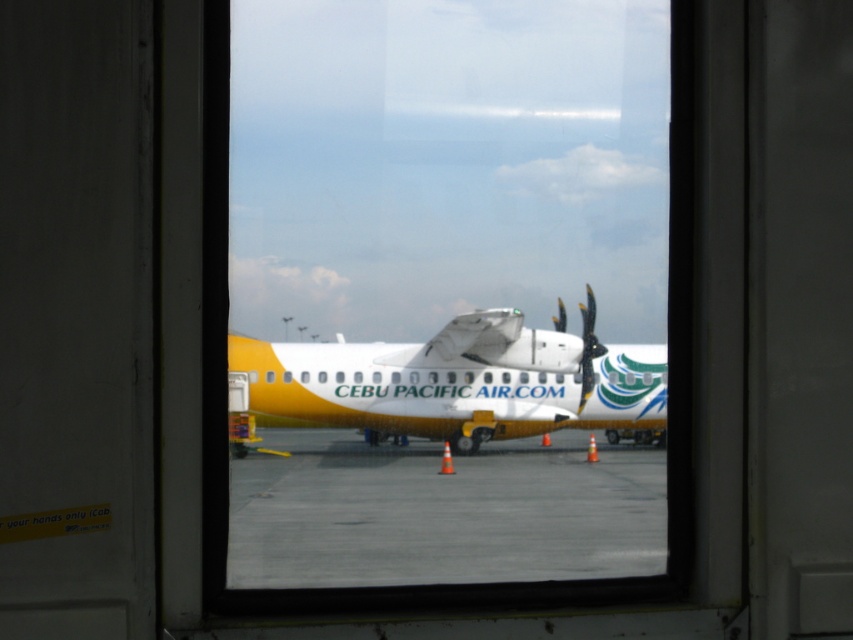
Does transparent glass airplane at center appear on the right side of yellow matte airplane at center?

Indeed, transparent glass airplane at center is positioned on the right side of yellow matte airplane at center.

Is point (323, 560) closer to camera compared to point (312, 403)?

Yes, point (323, 560) is closer to viewer.

Identify the location of transparent glass airplane at center. (445, 292).

Based on the photo, is the position of concrete tarmac at center less distant than that of polished metallic propeller at right?

Yes, it is.

Does concrete tarmac at center have a larger size compared to polished metallic propeller at right?

Indeed, concrete tarmac at center has a larger size compared to polished metallic propeller at right.

Measure the distance between point [384,515] and camera.

6.74 feet

Identify the location of concrete tarmac at center. The image size is (853, 640). (442, 513).

Between point (486, 336) and point (596, 342), which one is positioned in front?

Point (486, 336) is more forward.

Between point (376, 349) and point (584, 392), which one is positioned behind?

Positioned behind is point (584, 392).

Locate an element on the screen. transparent glass airplane at center is located at coordinates (445, 292).